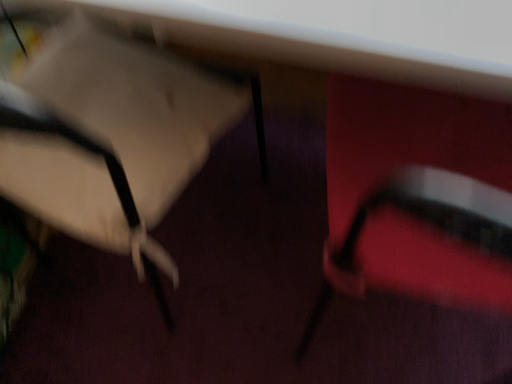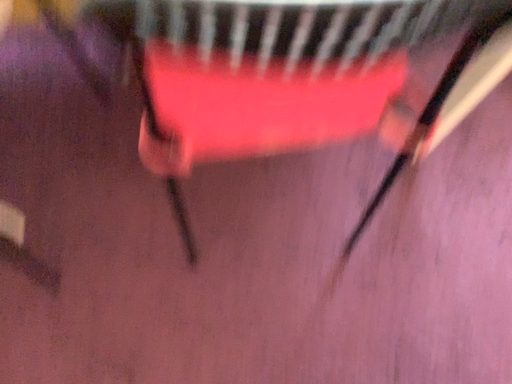
Question: How did the camera likely rotate when shooting the video?

Choices:
 (A) rotated downward
 (B) rotated upward

Answer: (A)